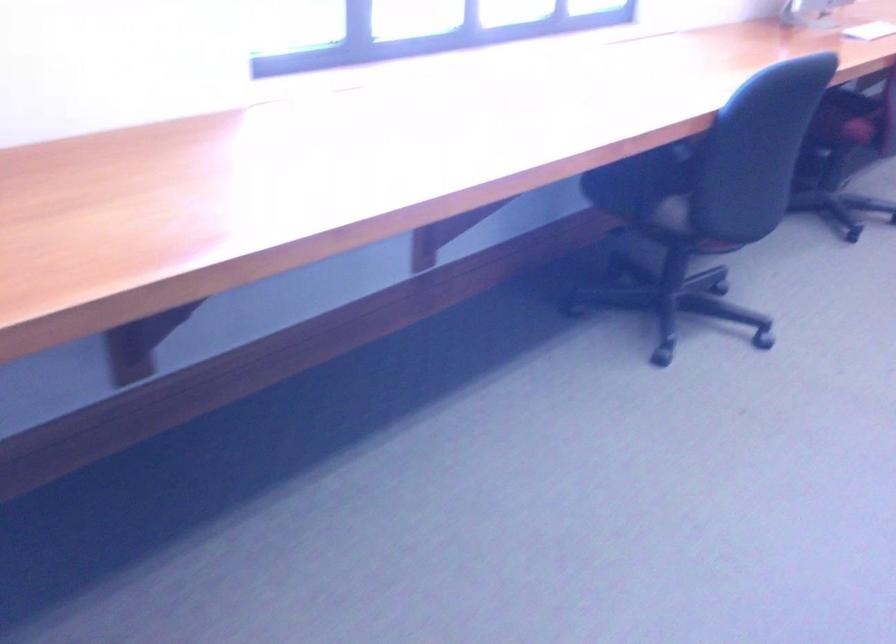
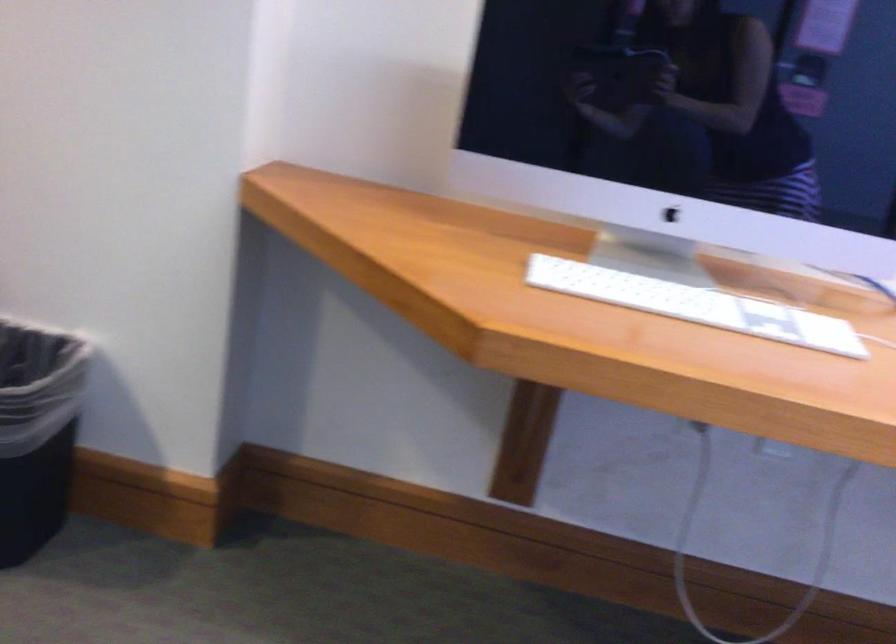
Question: Based on the continuous images, in which direction is the camera rotating? Reply with the corresponding letter.

Choices:
 (A) Left
 (B) Right
 (C) Up
 (D) Down

Answer: (A)